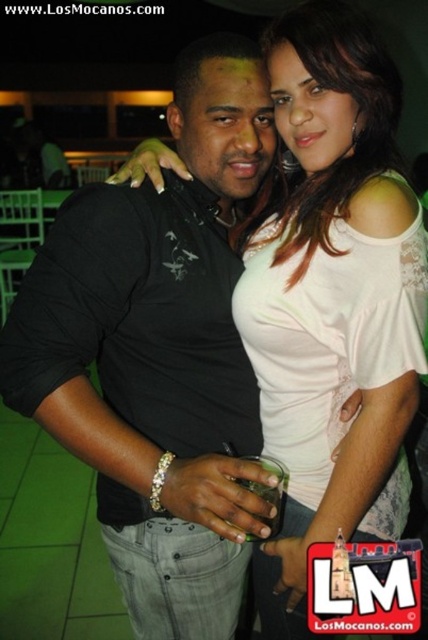
Does black matte shirt at center appear under white lace top at center?

Correct, black matte shirt at center is located below white lace top at center.

Which is in front, point (210, 371) or point (388, 115)?

Point (388, 115) is in front.

What do you see at coordinates (158, 353) in the screenshot?
I see `black matte shirt at center` at bounding box center [158, 353].

Image resolution: width=428 pixels, height=640 pixels. What are the coordinates of `black matte shirt at center` in the screenshot? It's located at (158, 353).